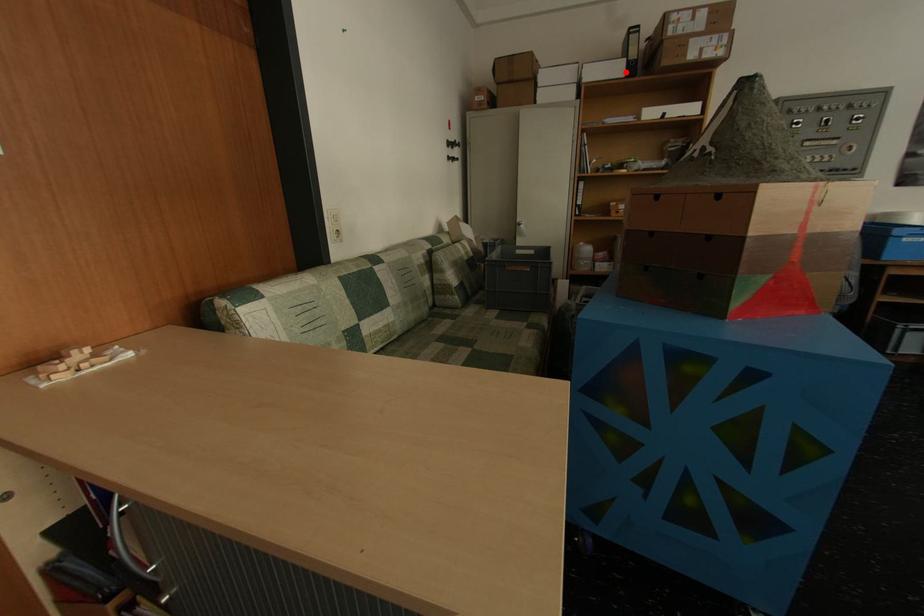
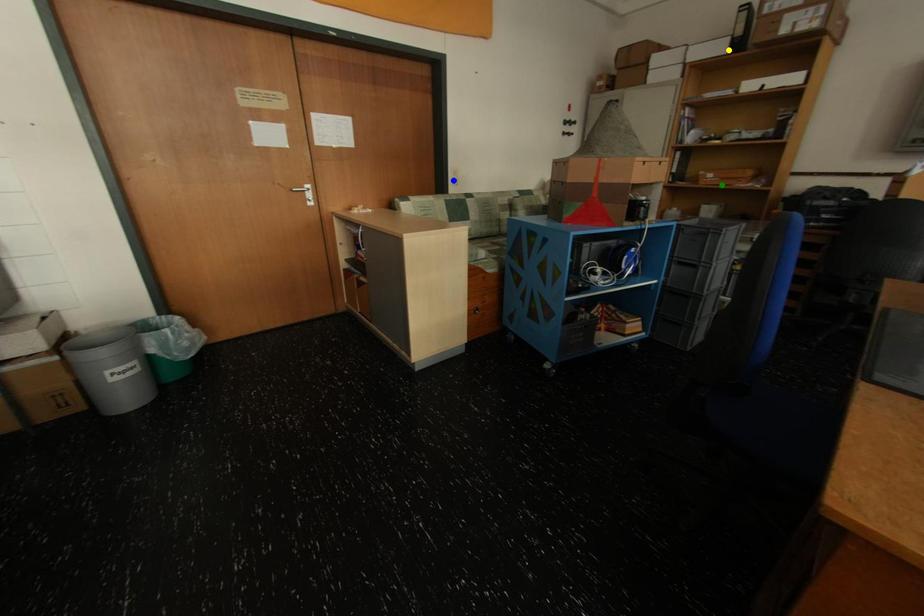
Question: I am providing you with two images of the same scene from different viewpoints. A red point is marked on the first image. You are given multiple points on the second image. Which spot in image 2 lines up with the point in image 1?

Choices:
 (A) yellow point
 (B) blue point
 (C) green point

Answer: (A)